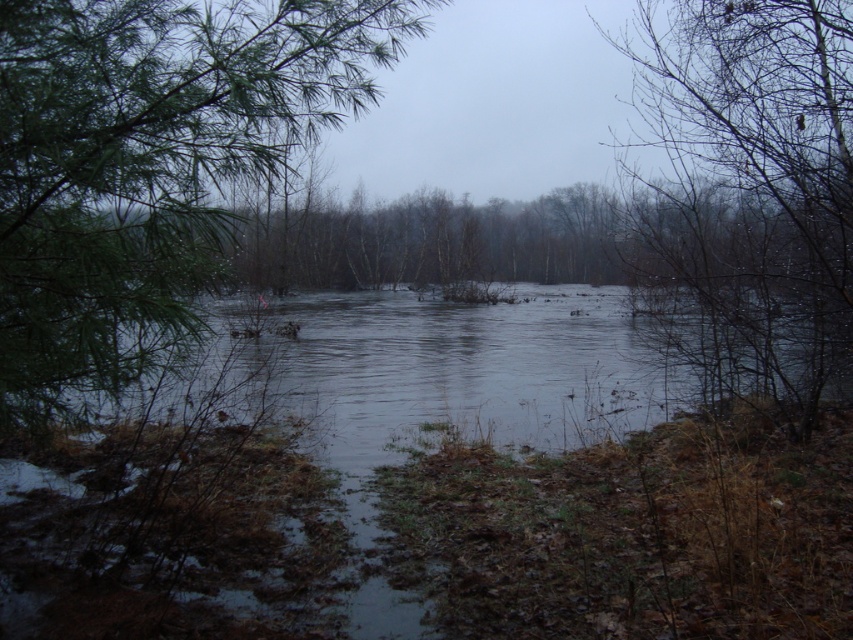
You are standing on the muddy bank and want to cross to the other side. The dark gray water at center and the bare branches at center are in your path. Which one do you need to avoid stepping on to stay dry?

You should avoid stepping on the dark gray water at center because its width is larger than the bare branches at center, making it the wider obstacle between the two.